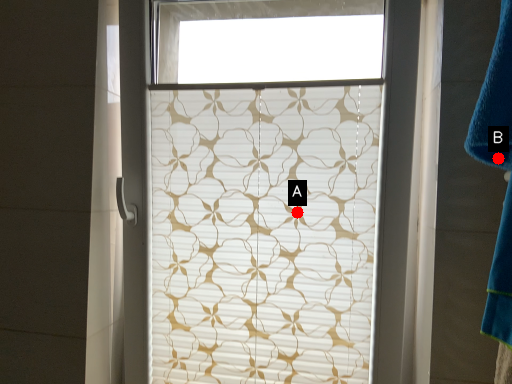
Question: Two points are circled on the image, labeled by A and B beside each circle. Which point appears closest to the camera in this image?

Choices:
 (A) A is closer
 (B) B is closer

Answer: (B)